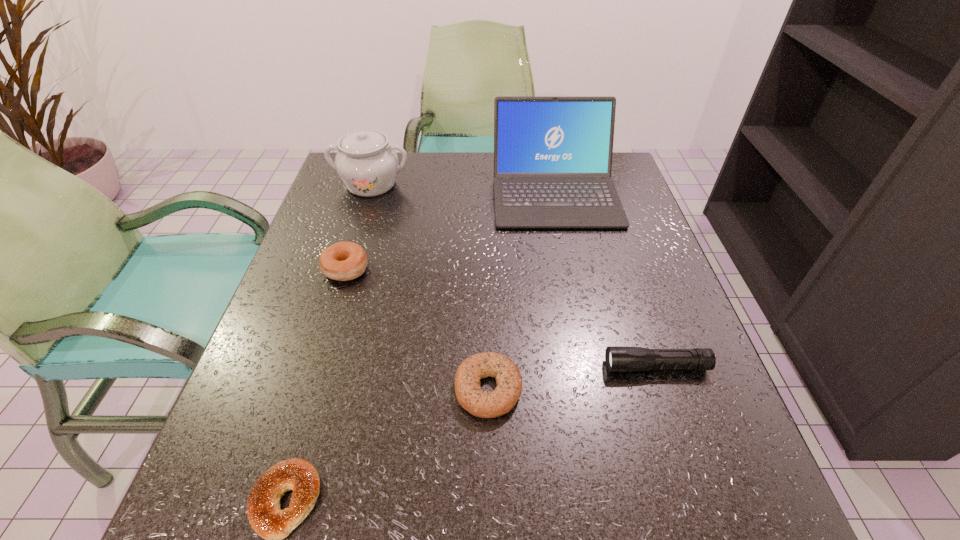
Locate an element on the screen. vacant region located at the lens end of the flashlight is located at coordinates (549, 367).

The image size is (960, 540). I want to click on vacant space located at the lens end of the flashlight, so click(x=402, y=367).

At what (x,y) coordinates should I click in order to perform the action: click on free location located 0.150m at the lens end of the flashlight. Please return your answer as a coordinate pair (x, y). This screenshot has height=540, width=960. Looking at the image, I should click on (521, 367).

The height and width of the screenshot is (540, 960). Find the location of `free location located on the back of the rightmost bagel`. free location located on the back of the rightmost bagel is located at coordinates (487, 283).

You are a GUI agent. You are given a task and a screenshot of the screen. Output one action in this format:
    pyautogui.click(x=<x>, y=<y>)
    Task: Click on the laptop computer that is at the far edge
    
    Given the screenshot: What is the action you would take?
    pyautogui.click(x=552, y=155)

Image resolution: width=960 pixels, height=540 pixels. Find the location of `chinaware that is positioned at the far edge`. chinaware that is positioned at the far edge is located at coordinates (368, 166).

This screenshot has height=540, width=960. What are the coordinates of `chinaware located at the left edge` in the screenshot? It's located at (368, 166).

Locate an element on the screen. The height and width of the screenshot is (540, 960). bagel situated at the left edge is located at coordinates (343, 261).

Where is `laptop computer positioned at the right edge`? This screenshot has width=960, height=540. laptop computer positioned at the right edge is located at coordinates (552, 155).

I want to click on flashlight that is positioned at the right edge, so click(617, 358).